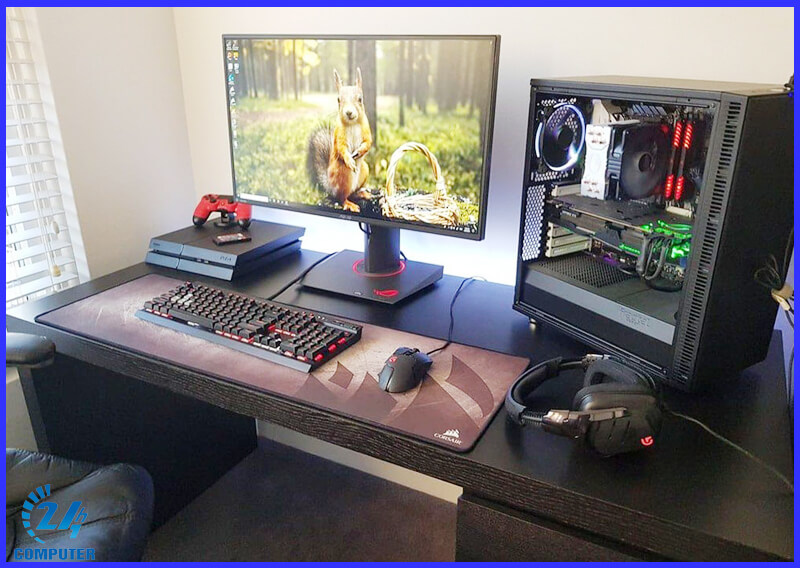
The height and width of the screenshot is (568, 800). I want to click on mouse pad, so click(x=446, y=408).